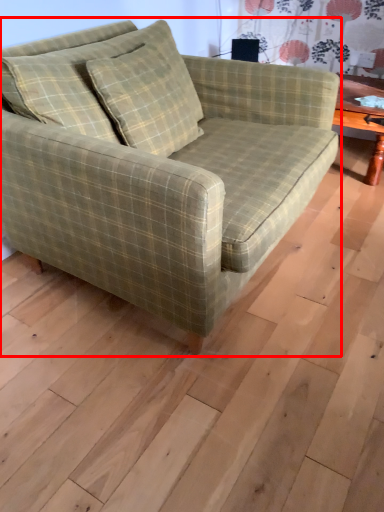
Question: From the image's perspective, where is studio couch (annotated by the red box) located relative to pillow?

Choices:
 (A) above
 (B) below

Answer: (B)